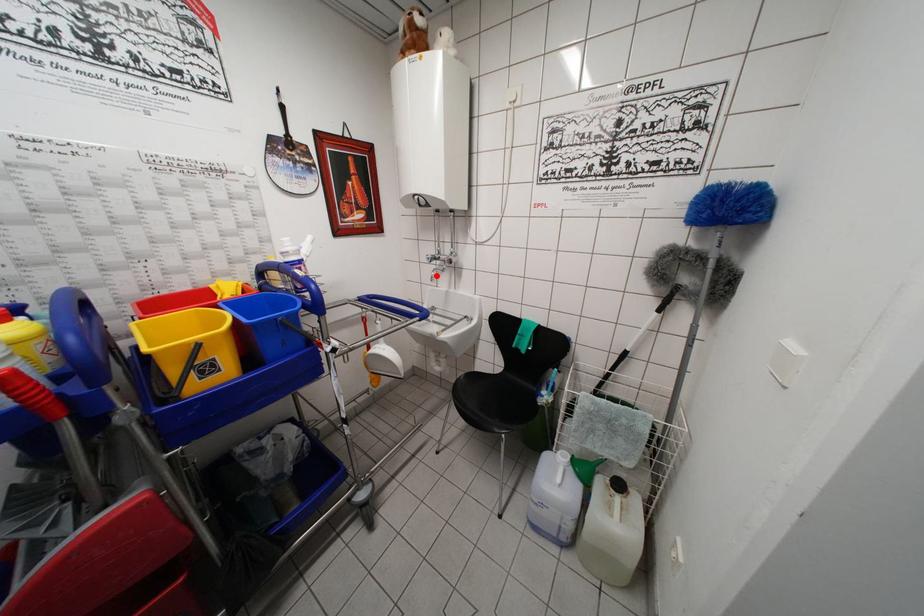
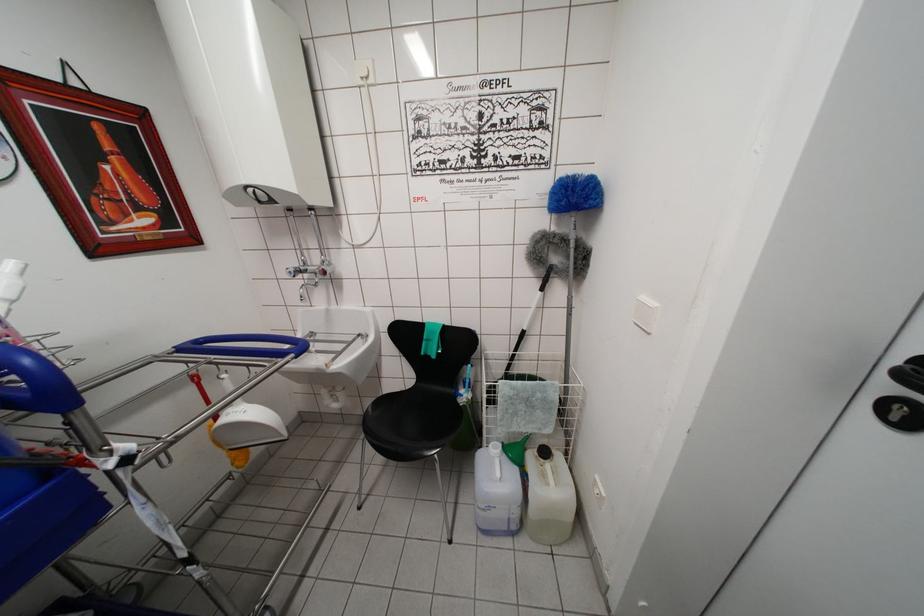
In the second image, find the point that corresponds to the highlighted location in the first image.

(305, 292)